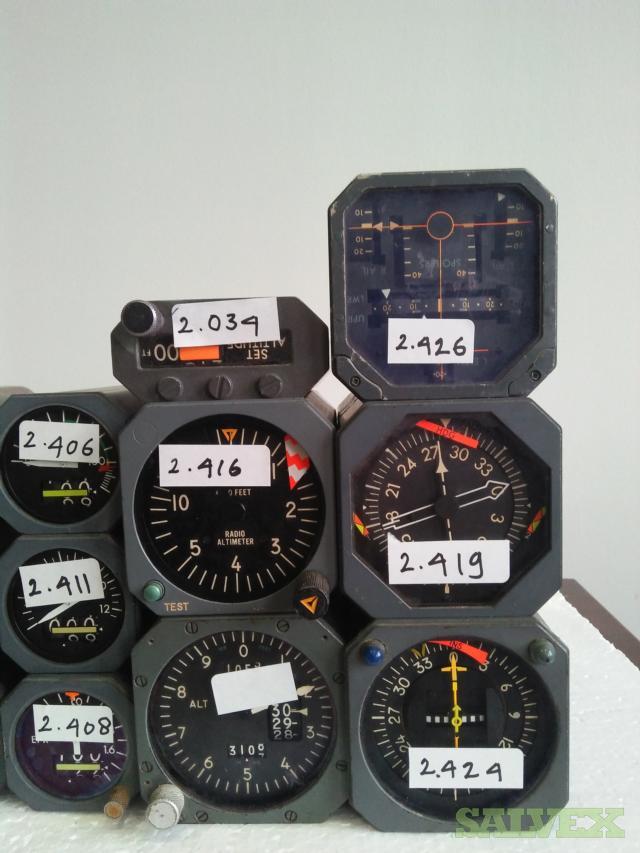
Locate an element on the screen. The height and width of the screenshot is (853, 640). white wall is located at coordinates (75, 64).